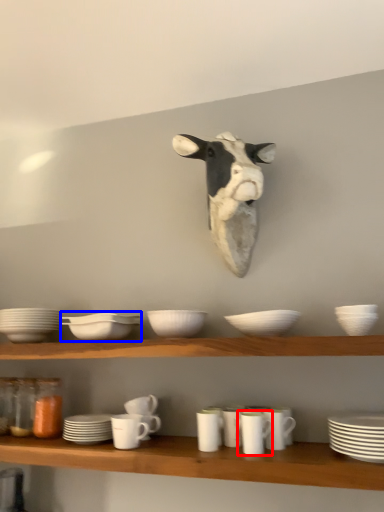
Question: Which object is further to the camera taking this photo, tableware (highlighted by a red box) or tableware (highlighted by a blue box)?

Choices:
 (A) tableware
 (B) tableware

Answer: (B)